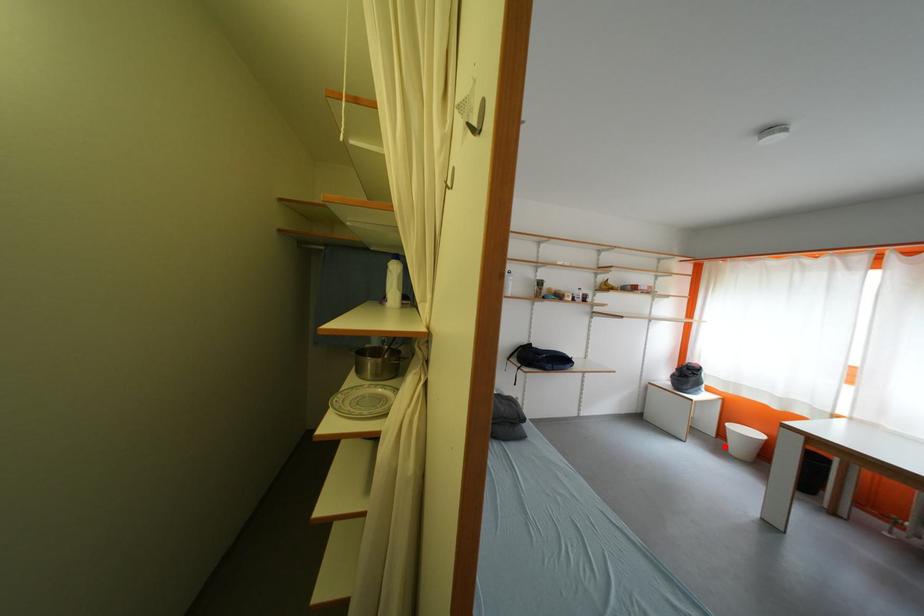
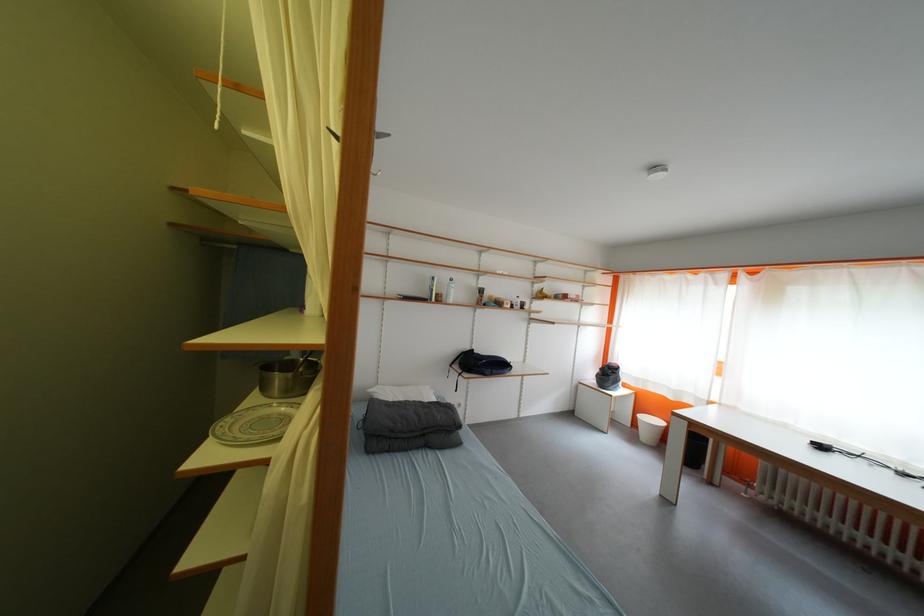
Question: I am providing you with two images of the same scene from different viewpoints. Given a red point in image1, look at the same physical point in image2. Is it:

Choices:
 (A) Closer to the viewpoint
 (B) Farther from the viewpoint

Answer: (B)